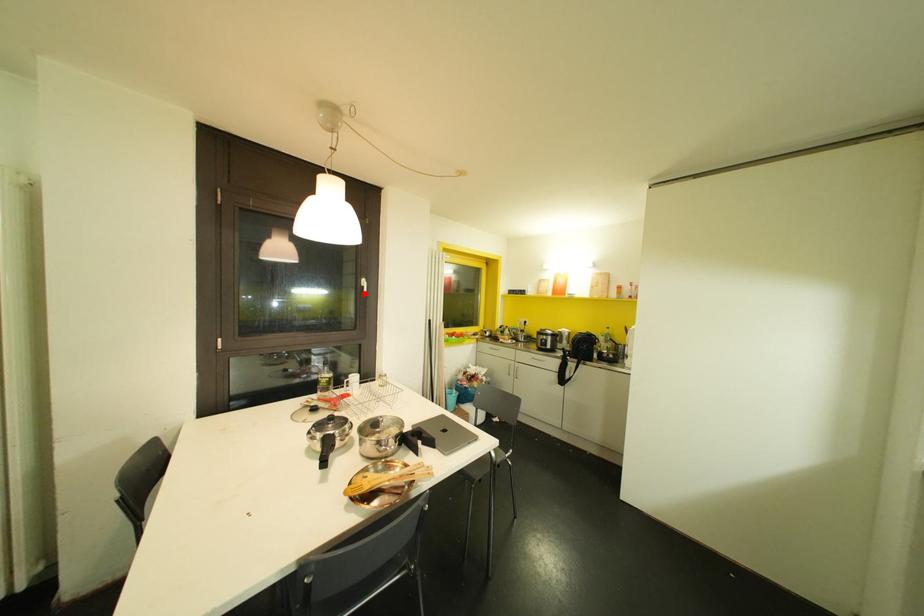
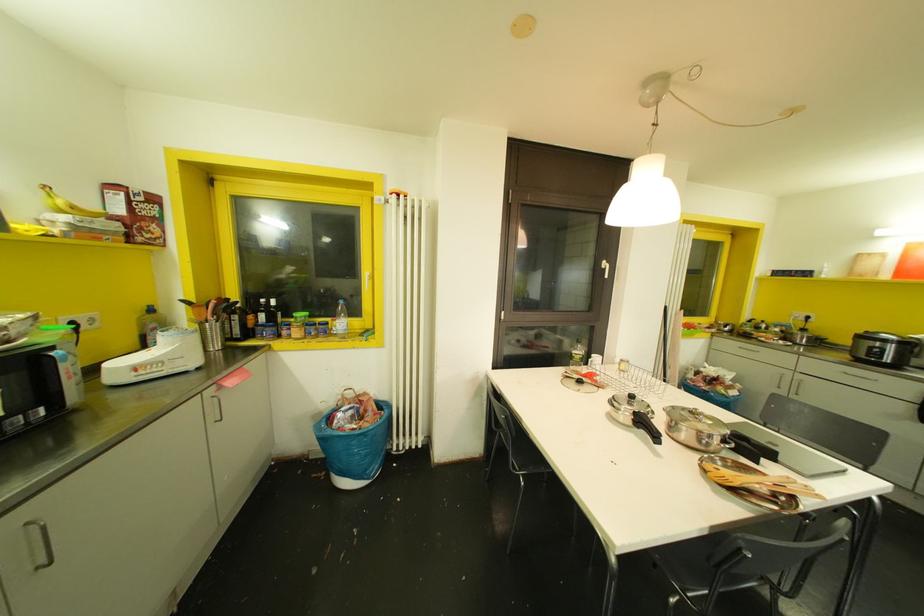
Locate, in the second image, the point that corresponds to the highlighted location in the first image.

(605, 276)